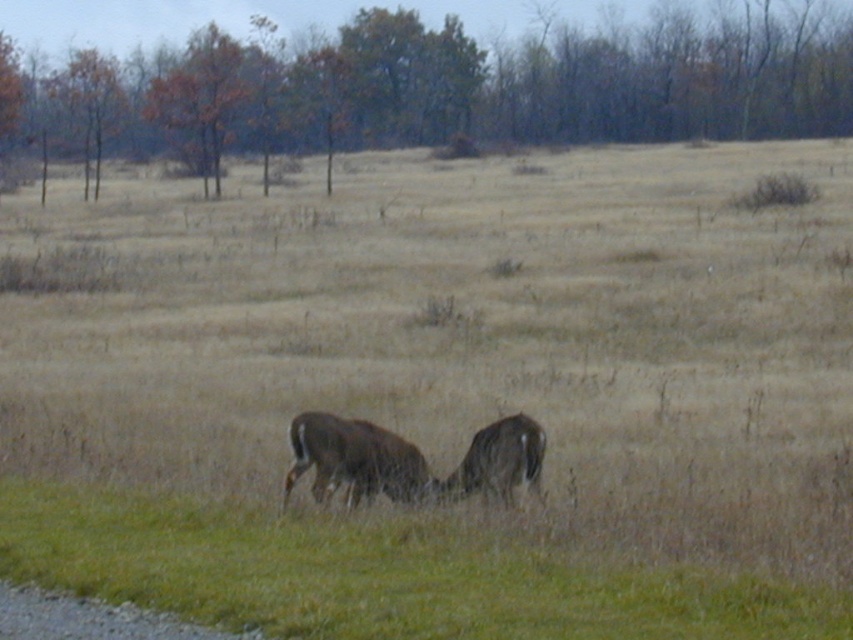
Question: Considering the relative positions of green grass at lower center and brown fur deer at center in the image provided, where is green grass at lower center located with respect to brown fur deer at center?

Choices:
 (A) below
 (B) above

Answer: (A)

Question: Which point is closer to the camera?

Choices:
 (A) brown fur deer at center
 (B) green grass at lower center

Answer: (B)

Question: Can you confirm if green grass at lower center is bigger than brown fur deer at center?

Choices:
 (A) yes
 (B) no

Answer: (B)

Question: Which point is closer to the camera taking this photo?

Choices:
 (A) (503, 417)
 (B) (173, 573)

Answer: (B)

Question: Is green grass at lower center above brown fur deer at center?

Choices:
 (A) no
 (B) yes

Answer: (A)

Question: Which point is closer to the camera?

Choices:
 (A) (479, 547)
 (B) (515, 444)

Answer: (A)